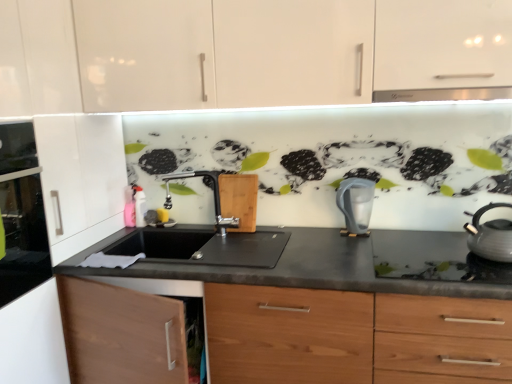
Question: From the image's perspective, is white glossy gas stove at right over black matte countertop at center?

Choices:
 (A) yes
 (B) no

Answer: (A)

Question: Is white glossy gas stove at right next to black matte countertop at center?

Choices:
 (A) yes
 (B) no

Answer: (B)

Question: Is white glossy gas stove at right facing away from black matte countertop at center?

Choices:
 (A) no
 (B) yes

Answer: (B)

Question: Is white glossy gas stove at right to the left of black matte countertop at center from the viewer's perspective?

Choices:
 (A) yes
 (B) no

Answer: (B)

Question: From a real-world perspective, is white glossy gas stove at right located beneath black matte countertop at center?

Choices:
 (A) yes
 (B) no

Answer: (B)

Question: From a real-world perspective, relative to glass door oven at left, is satin nickel faucet at center vertically above or below?

Choices:
 (A) below
 (B) above

Answer: (A)

Question: Looking at their shapes, would you say satin nickel faucet at center is wider or thinner than glass door oven at left?

Choices:
 (A) wide
 (B) thin

Answer: (A)

Question: Considering the positions of point (215, 185) and point (34, 238), is point (215, 185) closer or farther from the camera than point (34, 238)?

Choices:
 (A) farther
 (B) closer

Answer: (A)

Question: Would you say satin nickel faucet at center is inside or outside glass door oven at left?

Choices:
 (A) outside
 (B) inside

Answer: (A)

Question: Is satin nickel faucet at center in front of or behind matte gray kettle at right, acting as the second kitchen appliance starting from the back, in the image?

Choices:
 (A) front
 (B) behind

Answer: (B)

Question: Looking at their shapes, would you say satin nickel faucet at center is wider or thinner than matte gray kettle at right, acting as the second kitchen appliance starting from the left?

Choices:
 (A) thin
 (B) wide

Answer: (A)

Question: Would you say satin nickel faucet at center is to the left or to the right of matte gray kettle at right, the 1th kitchen appliance positioned from the right, in the picture?

Choices:
 (A) left
 (B) right

Answer: (A)

Question: From the image's perspective, is satin nickel faucet at center located above or below matte gray kettle at right, which is the first kitchen appliance in front-to-back order?

Choices:
 (A) below
 (B) above

Answer: (B)

Question: Based on their sizes in the image, would you say glass door oven at left is bigger or smaller than black matte countertop at center?

Choices:
 (A) big
 (B) small

Answer: (B)

Question: Considering the positions of glass door oven at left and black matte countertop at center in the image, is glass door oven at left wider or thinner than black matte countertop at center?

Choices:
 (A) thin
 (B) wide

Answer: (A)